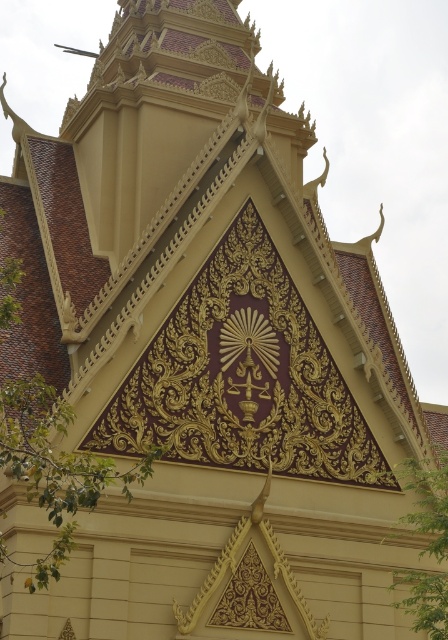
You are standing in front of the building and want to take a photo of the triangular gable with the green leafy tree at center in the background. Based on the coordinates provided, will the tree be centered in the photo?

The green leafy tree at center is located at coordinates point (54, 467), which means it is positioned to the right and slightly lower than the exact center of the image. Therefore, the tree will not be perfectly centered in the photo.